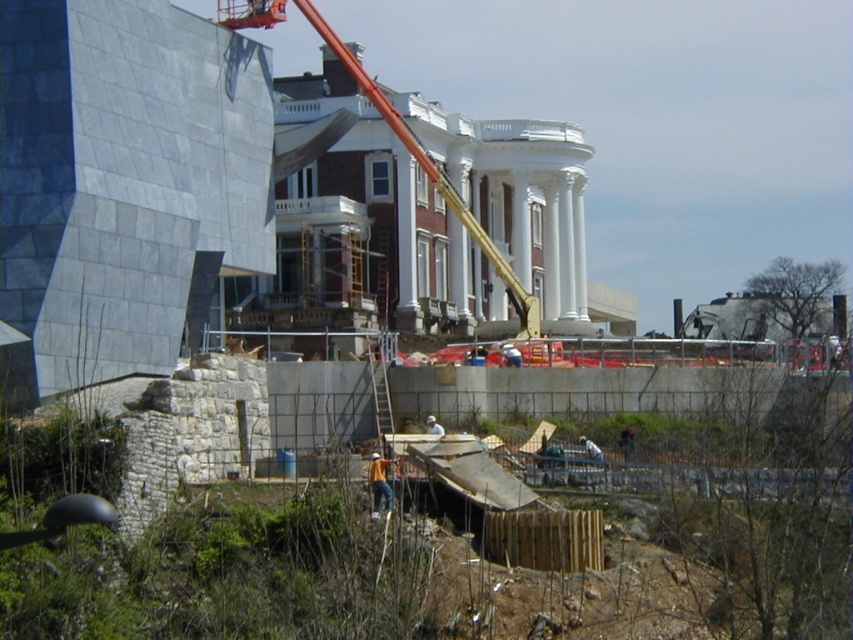
You are a construction worker standing at the point with coordinates 0.3,0.5. You need to move to the orange metallic crane at center. In which direction should you walk to reach it?

The orange metallic crane at center is located at point [431,173]. Since you are at [426,192], you should walk slightly to the left and forward to reach it.

You are a construction worker who needs to move a heavy beam from the orange metallic crane at center to the white matte hard hat at center. The beam is 40 meters long. Can you safely transport the beam without it touching the ground?

The distance between the orange metallic crane at center and the white matte hard hat at center is 41.95 meters. Since the beam is only 40 meters long, it would be 1.95 meters shorter than the required distance. Therefore, the beam cannot span the entire distance and would need to be supported or moved in sections to avoid touching the ground.